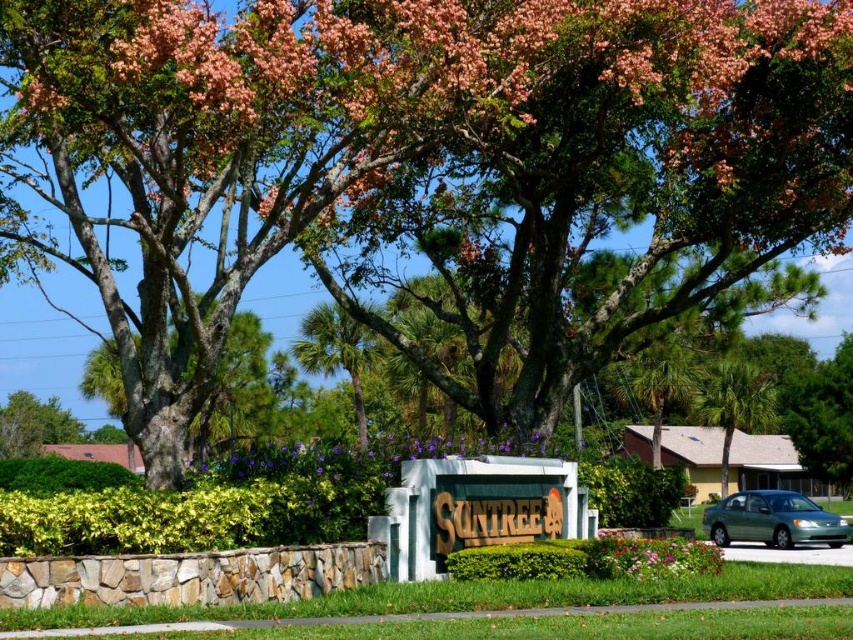
Question: Is purple matte flowers at center wider than multicolored fabric flower at lower center?

Choices:
 (A) no
 (B) yes

Answer: (B)

Question: Among these objects, which one is farthest from the camera?

Choices:
 (A) purple matte flowers at center
 (B) white stone wall at center
 (C) multicolored fabric flower at lower center

Answer: (C)

Question: Can you confirm if green leafy palm tree at upper right is smaller than multicolored fabric flower at lower center?

Choices:
 (A) yes
 (B) no

Answer: (B)

Question: Which point is farther from the camera taking this photo?

Choices:
 (A) (756, 540)
 (B) (598, 568)
 (C) (718, 372)

Answer: (C)

Question: Does white stone wall at center appear over multicolored fabric flower at lower center?

Choices:
 (A) no
 (B) yes

Answer: (B)

Question: Which of the following is the farthest from the observer?

Choices:
 (A) purple matte flowers at center
 (B) green leafy tree at upper left
 (C) green matte sedan at lower right
 (D) white stone wall at center

Answer: (B)